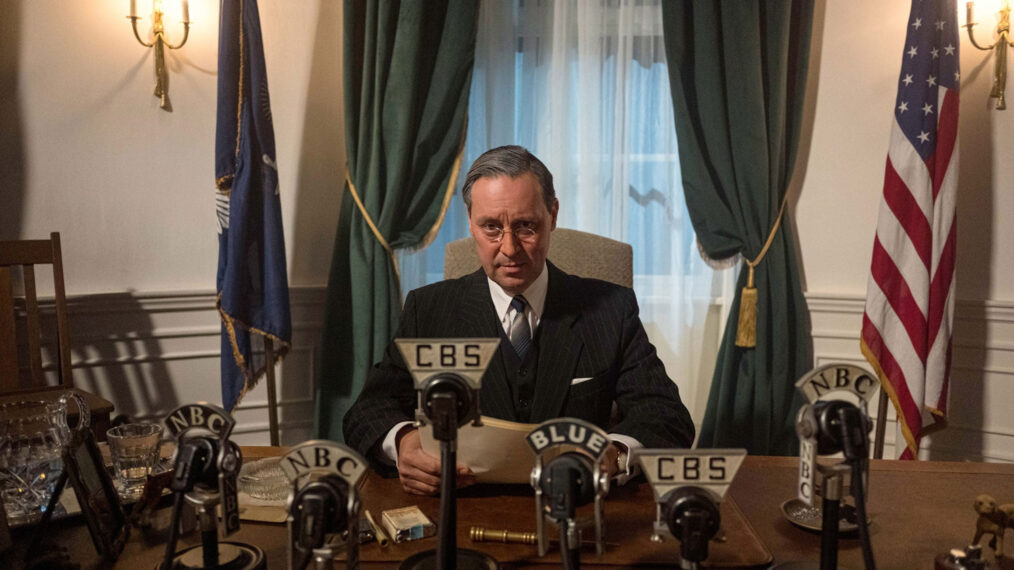
Identify the location of green drapes. The image size is (1014, 570). (731, 121), (744, 374), (378, 195), (346, 304).